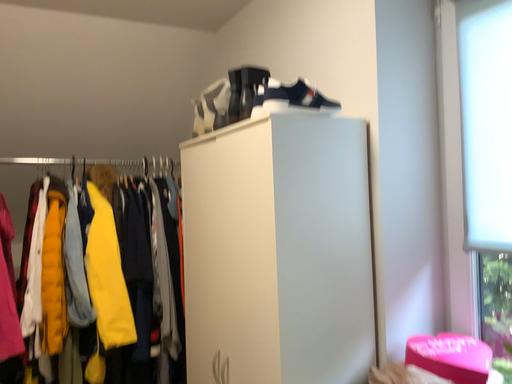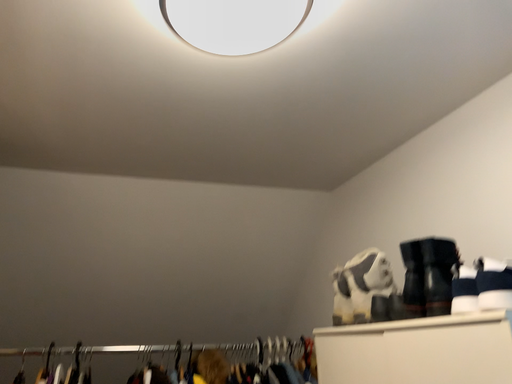
Question: How did the camera likely rotate when shooting the video?

Choices:
 (A) rotated downward
 (B) rotated upward

Answer: (B)